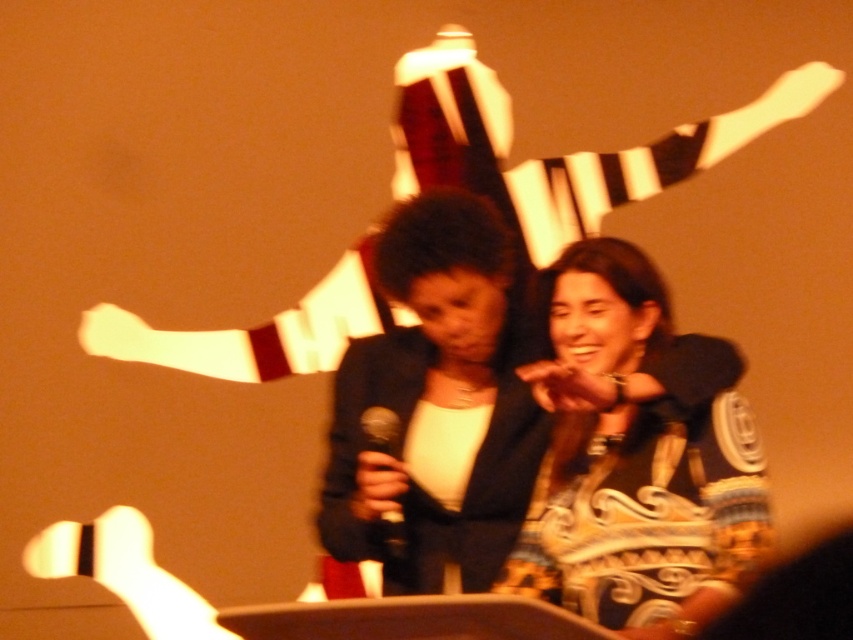
You are standing in the audience looking at the stage. There are two points marked on the stage. The first point is at coordinate point (596, 561) and the second is at point (430, 276). Which point do you see closer to you?

Point (596, 561) is closer to the camera than point (430, 276), so you see the first point closer to you.

You are a stagehand adjusting the lighting for the performance. You need to ensure both the matte black jacket at center and the black matte microphone at center are well lit. Since one is larger than the other, which object requires a wider spotlight to cover its entire area?

The matte black jacket at center requires a wider spotlight because it is larger in size than the black matte microphone at center.